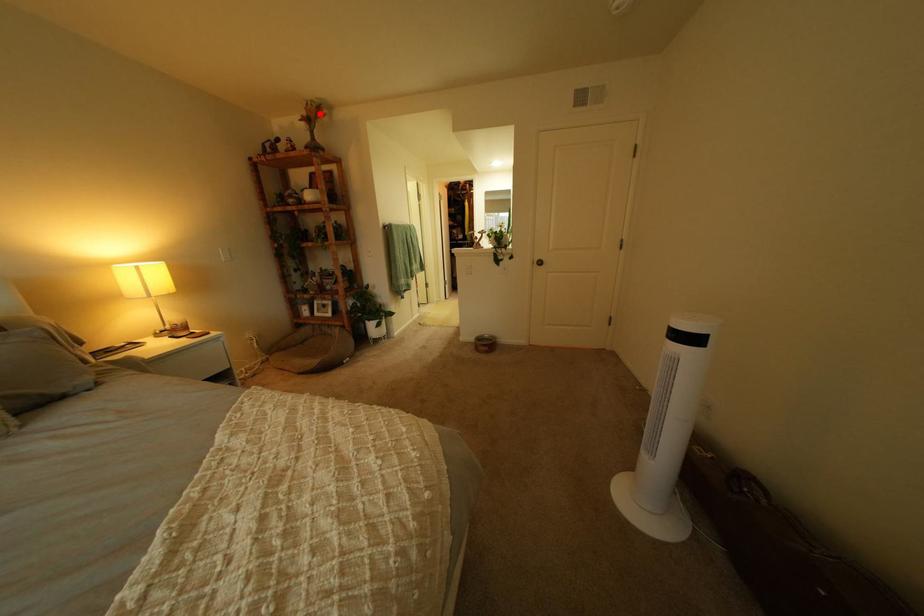
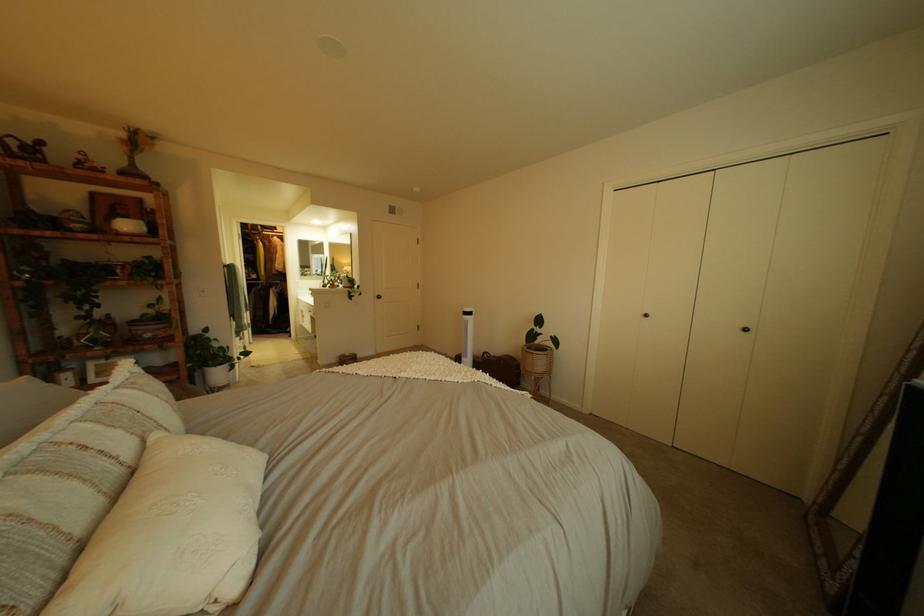
In the second image, find the point that corresponds to the highlighted location in the first image.

(139, 137)